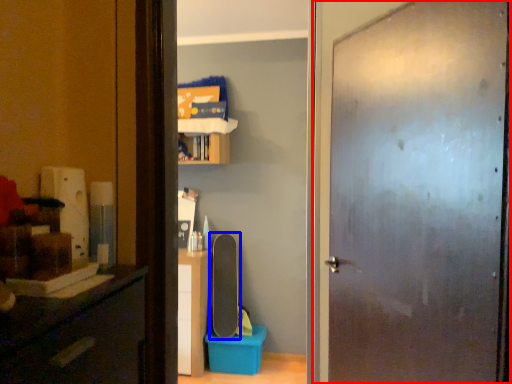
Question: Among these objects, which one is nearest to the camera, door (highlighted by a red box) or skateboard (highlighted by a blue box)?

Choices:
 (A) door
 (B) skateboard

Answer: (A)